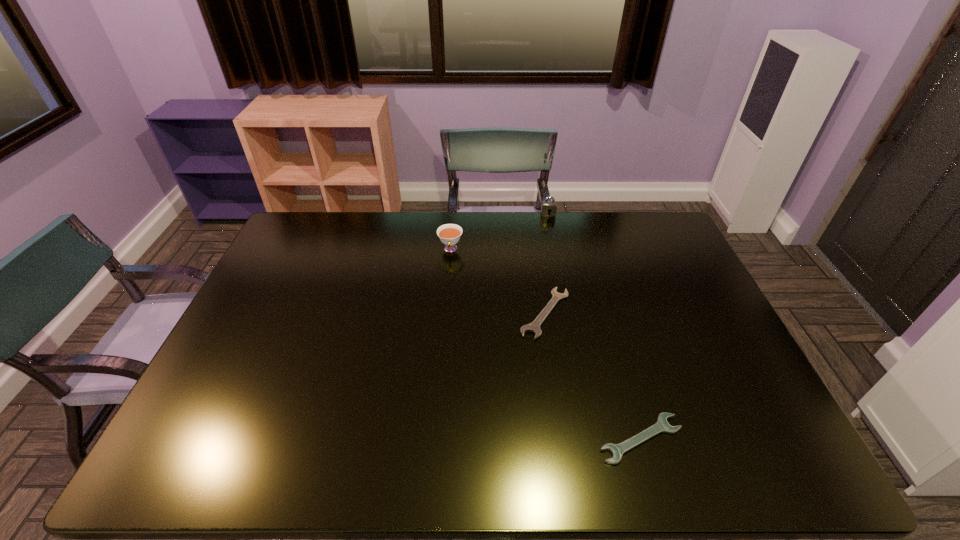
Image resolution: width=960 pixels, height=540 pixels. I want to click on free space between the farther wrench and the padlock, so click(x=547, y=264).

Locate an element on the screen. This screenshot has height=540, width=960. free spot between the third nearest object and the farther wrench is located at coordinates [x=498, y=281].

Where is `free point between the third farthest object and the padlock`? Image resolution: width=960 pixels, height=540 pixels. free point between the third farthest object and the padlock is located at coordinates (547, 264).

Identify the location of free point between the nearer wrench and the farthest object. The image size is (960, 540). point(594,327).

Locate an element on the screen. This screenshot has width=960, height=540. free spot between the nearest object and the second farthest object is located at coordinates (545, 344).

This screenshot has width=960, height=540. What are the coordinates of `free point between the padlock and the farther wrench` in the screenshot? It's located at (547, 264).

You are a GUI agent. You are given a task and a screenshot of the screen. Output one action in this format:
    pyautogui.click(x=<x>, y=<y>)
    Task: Click on the vacant space that is in between the farthest object and the second farthest object
    This screenshot has width=960, height=540.
    Given the screenshot: What is the action you would take?
    pyautogui.click(x=499, y=232)

Identify the location of vacant space that is in between the third farthest object and the farthest object. (547, 264).

Image resolution: width=960 pixels, height=540 pixels. In order to click on vacant point located between the nearer wrench and the farther wrench in this screenshot , I will do `click(593, 376)`.

Locate which object ranks third in proximity to the farther wrench. Please provide its 2D coordinates. Your answer should be formatted as a tuple, i.e. [(x, y)], where the tuple contains the x and y coordinates of a point satisfying the conditions above.

[(547, 206)]